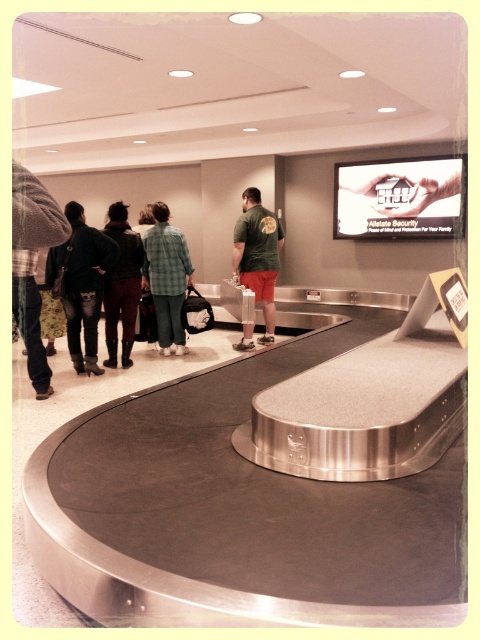
Can you confirm if green matte shirt at center is positioned above dark green leather jacket at left?

Correct, green matte shirt at center is located above dark green leather jacket at left.

Find the location of a particular element. green matte shirt at center is located at coordinates (257, 253).

Identify the location of green matte shirt at center. point(257,253).

Between point (68, 310) and point (109, 342), which one is positioned behind?

The point (109, 342) is behind.

Is denim jacket at left closer to the viewer compared to dark green leather jacket at left?

Yes, it is in front of dark green leather jacket at left.

Who is more distant from viewer, (x=47, y=282) or (x=123, y=266)?

The point (x=123, y=266) is more distant.

At what (x,y) coordinates should I click in order to perform the action: click on denim jacket at left. Please return your answer as a coordinate pair (x, y). The width and height of the screenshot is (480, 640). Looking at the image, I should click on (81, 284).

Consider the image. Which is more to the right, denim jacket at left or green plaid shirt at center?

green plaid shirt at center

Which is in front, point (101, 280) or point (168, 230)?

Point (101, 280)

Between point (90, 260) and point (178, 237), which one is positioned in front?

Point (90, 260)

Identify the location of denim jacket at left. The image size is (480, 640). (81, 284).